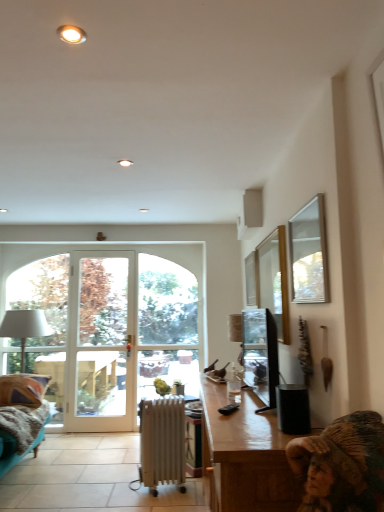
Image resolution: width=384 pixels, height=512 pixels. What do you see at coordinates (245, 455) in the screenshot? I see `wooden desk at lower right` at bounding box center [245, 455].

What do you see at coordinates (99, 339) in the screenshot? Image resolution: width=384 pixels, height=512 pixels. I see `white glass door at center` at bounding box center [99, 339].

This screenshot has height=512, width=384. In order to click on white metallic radiator at center in this screenshot , I will do `click(162, 443)`.

Locate an element on the screen. white glass window at center, which is the first window in left-to-right order is located at coordinates (167, 325).

What do you see at coordinates (274, 280) in the screenshot? Image resolution: width=384 pixels, height=512 pixels. I see `clear glass window at upper right, acting as the 1th window starting from the front` at bounding box center [274, 280].

At what (x,y) coordinates should I click in order to perform the action: click on white fabric lampshade at left. Please return your answer as a coordinate pair (x, y). This screenshot has width=384, height=512. Looking at the image, I should click on (24, 327).

This screenshot has width=384, height=512. What are the coordinates of `window lying below the clear glass window at upper right, acting as the 1th window starting from the front (from the image's perspective)` in the screenshot? It's located at (167, 325).

From a real-world perspective, is clear glass window at upper right, which ranks as the 3th window in left-to-right order, under white glass window at center, positioned as the first window in back-to-front order?

No, from a real-world perspective, clear glass window at upper right, which ranks as the 3th window in left-to-right order, is not under white glass window at center, positioned as the first window in back-to-front order.

Consider the image. Between clear glass window at upper right, the 3th window when ordered from back to front, and white glass window at center, which is the first window in left-to-right order, which one has less height?

With less height is clear glass window at upper right, the 3th window when ordered from back to front.

Which is in front, point (272, 282) or point (148, 288)?

Point (272, 282)

Who is smaller, white metallic radiator at center or wooden desk at lower right?

Smaller between the two is white metallic radiator at center.

Is white metallic radiator at center at the left side of wooden desk at lower right?

Yes, white metallic radiator at center is to the left of wooden desk at lower right.

Would you say white metallic radiator at center is inside or outside wooden desk at lower right?

white metallic radiator at center is spatially situated outside wooden desk at lower right.

Which is closer to the camera, (262, 437) or (246, 295)?

Clearly, point (262, 437) is closer to the camera than point (246, 295).

Which is behind, wooden desk at lower right or transparent glass window at upper center, arranged as the 2th window when viewed from the front?

transparent glass window at upper center, arranged as the 2th window when viewed from the front, is further away from the camera.

Can we say wooden desk at lower right lies outside transparent glass window at upper center, positioned as the second window in back-to-front order?

That's correct, wooden desk at lower right is outside of transparent glass window at upper center, positioned as the second window in back-to-front order.

Is wooden desk at lower right in contact with transparent glass window at upper center, which appears as the second window when viewed from the right?

No, wooden desk at lower right is not beside transparent glass window at upper center, which appears as the second window when viewed from the right.

Locate an element on the screen. The height and width of the screenshot is (512, 384). television lying on the right of plush fabric couch at lower left is located at coordinates (261, 354).

Can you confirm if satin black television at right is taller than plush fabric couch at lower left?

Indeed, satin black television at right has a greater height compared to plush fabric couch at lower left.

From the image's perspective, is satin black television at right located above plush fabric couch at lower left?

Yes, from the image's perspective, satin black television at right is above plush fabric couch at lower left.

Which is in front, point (267, 318) or point (247, 296)?

The point (267, 318) is closer to the camera.

Would you consider satin black television at right to be distant from transparent glass window at upper center, arranged as the 2th window when viewed from the front?

No, there isn't a large distance between satin black television at right and transparent glass window at upper center, arranged as the 2th window when viewed from the front.

Is satin black television at right oriented towards transparent glass window at upper center, acting as the 2th window starting from the left?

No, satin black television at right is not oriented towards transparent glass window at upper center, acting as the 2th window starting from the left.

Which object is positioned more to the left, white fabric lampshade at left or clear glass window at upper right, which ranks as the 3th window in left-to-right order?

From the viewer's perspective, white fabric lampshade at left appears more on the left side.

Which object is closer to the camera, white fabric lampshade at left or clear glass window at upper right, acting as the 1th window starting from the front?

clear glass window at upper right, acting as the 1th window starting from the front, is more forward.

From the image's perspective, starting from the white fabric lampshade at left, which window is the 2nd one above? Please provide its 2D coordinates.

[(274, 280)]

Is plush fabric couch at lower left taller than silver-framed mirror at upper right?

In fact, plush fabric couch at lower left may be shorter than silver-framed mirror at upper right.

In terms of width, does plush fabric couch at lower left look wider or thinner when compared to silver-framed mirror at upper right?

Clearly, plush fabric couch at lower left has more width compared to silver-framed mirror at upper right.

Where is `window screen above the plush fabric couch at lower left (from a real-world perspective)`? window screen above the plush fabric couch at lower left (from a real-world perspective) is located at coordinates (308, 254).

You are a GUI agent. You are given a task and a screenshot of the screen. Output one action in this format:
    pyautogui.click(x=<x>, y=<y>)
    Task: Click on the 2nd window in front of the white glass window at center, which is the first window in left-to-right order, counting from the anchor's position
    
    Given the screenshot: What is the action you would take?
    pyautogui.click(x=274, y=280)

You are a GUI agent. You are given a task and a screenshot of the screen. Output one action in this format:
    pyautogui.click(x=<x>, y=<y>)
    Task: Click on the radiator below the wooden desk at lower right (from a real-world perspective)
    
    Given the screenshot: What is the action you would take?
    pyautogui.click(x=162, y=443)

Estimate the real-world distances between objects in this image. Which object is further from plush fabric couch at lower left, satin black television at right or white glass door at center?

Among the two, satin black television at right is located further to plush fabric couch at lower left.

From the image, which object appears to be nearer to white fabric lampshade at left, wooden desk at lower right or satin black television at right?

satin black television at right lies closer to white fabric lampshade at left than the other object.

When comparing their distances from silver-framed mirror at upper right, does plush fabric couch at lower left or white metallic radiator at center seem closer?

white metallic radiator at center is closer to silver-framed mirror at upper right.

Looking at the image, which one is located closer to white fabric lampshade at left, plush fabric couch at lower left or silver-framed mirror at upper right?

plush fabric couch at lower left.

Which object lies nearer to the anchor point white fabric lampshade at left, clear glass window at upper right, the 3th window when ordered from back to front, or wooden desk at lower right?

The object closer to white fabric lampshade at left is clear glass window at upper right, the 3th window when ordered from back to front.

When comparing their distances from silver-framed mirror at upper right, does transparent glass window at upper center, arranged as the 2th window when viewed from the front, or clear glass window at upper right, the 1th window when ordered from right to left, seem further?

transparent glass window at upper center, arranged as the 2th window when viewed from the front, is further to silver-framed mirror at upper right.

When comparing their distances from transparent glass window at upper center, acting as the 2th window starting from the left, does satin black television at right or white metallic radiator at center seem further?

white metallic radiator at center lies further to transparent glass window at upper center, acting as the 2th window starting from the left, than the other object.

Which object lies nearer to the anchor point transparent glass window at upper center, arranged as the 2th window when viewed from the front, wooden desk at lower right or white fabric lampshade at left?

wooden desk at lower right.

You are a GUI agent. You are given a task and a screenshot of the screen. Output one action in this format:
    pyautogui.click(x=<x>, y=<y>)
    Task: Click on the radiator positioned between silver-framed mirror at upper right and transparent glass window at upper center, positioned as the second window in back-to-front order, from near to far
    
    Given the screenshot: What is the action you would take?
    pyautogui.click(x=162, y=443)

Locate an element on the screen. television positioned between silver-framed mirror at upper right and white glass window at center, which is the first window in left-to-right order, from near to far is located at coordinates (261, 354).

Find the location of a particular element. Image resolution: width=384 pixels, height=512 pixels. studio couch located between wooden desk at lower right and white glass door at center in the depth direction is located at coordinates (21, 416).

I want to click on radiator located between white fabric lampshade at left and satin black television at right in the left-right direction, so click(162, 443).